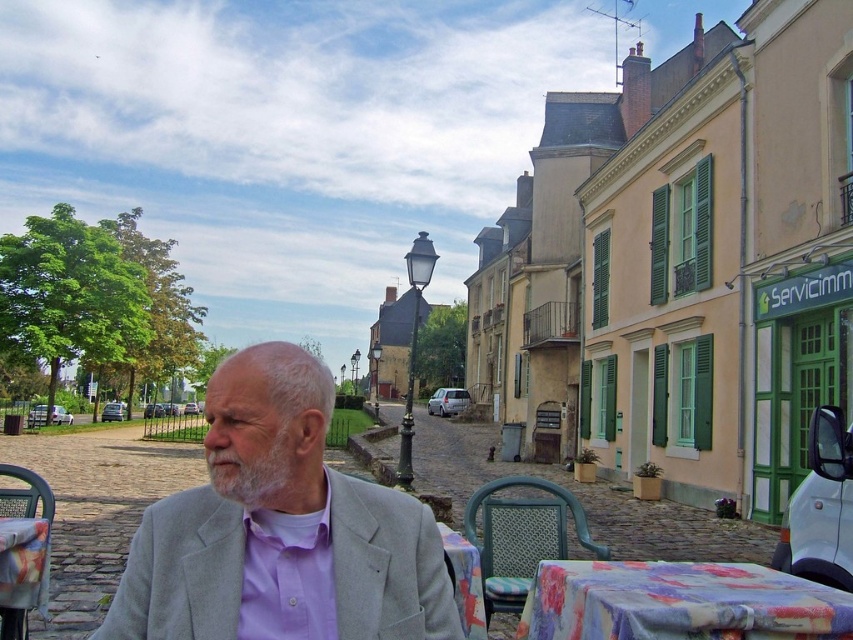
Question: Which of the following is the farthest from the observer?

Choices:
 (A) floral printed fabric at lower right
 (B) gray woolen suit at center
 (C) grayhairbeard at center
 (D) metallic mesh chair at lower left

Answer: (D)

Question: Which of the following is the closest to the observer?

Choices:
 (A) (247, 545)
 (B) (276, 426)
 (C) (618, 620)

Answer: (B)

Question: Does woven plastic chair at lower center have a lesser width compared to grayhairbeard at center?

Choices:
 (A) yes
 (B) no

Answer: (B)

Question: From the image, what is the correct spatial relationship of pastel yellow building with green shutters at center in relation to purple cotton shirt at center?

Choices:
 (A) right
 (B) left

Answer: (A)

Question: Among these points, which one is farthest from the camera?

Choices:
 (A) (766, 74)
 (B) (560, 547)
 (C) (260, 556)
 (D) (228, 493)

Answer: (A)

Question: In this image, where is pastel yellow building with green shutters at center located relative to woven plastic chair at lower center?

Choices:
 (A) above
 (B) below

Answer: (A)